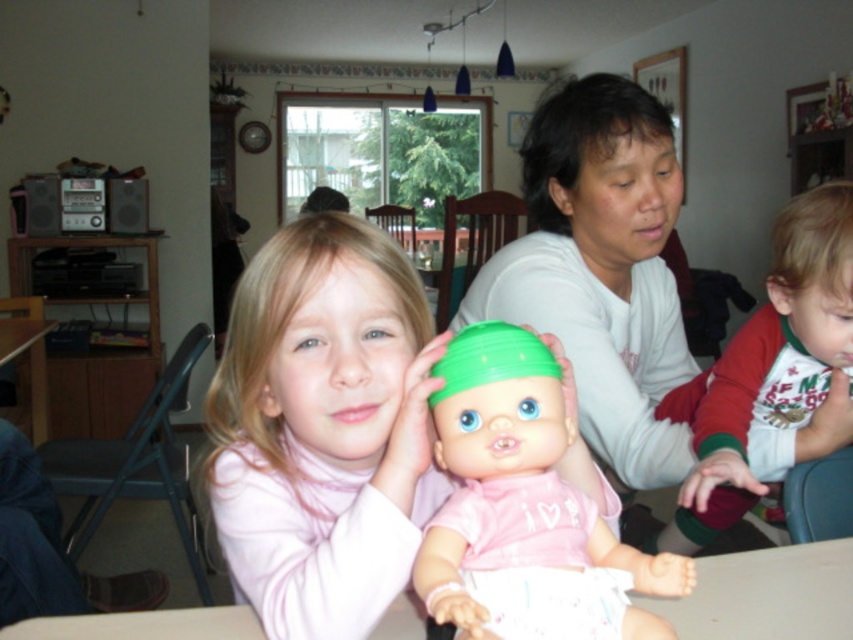
Question: Is green plastic doll at center wider than red fleece pajamas at lower right?

Choices:
 (A) no
 (B) yes

Answer: (A)

Question: Is green plastic doll at center above red fleece pajamas at lower right?

Choices:
 (A) yes
 (B) no

Answer: (A)

Question: Among these points, which one is nearest to the camera?

Choices:
 (A) (x=225, y=467)
 (B) (x=647, y=604)
 (C) (x=845, y=285)

Answer: (A)

Question: Among these objects, which one is farthest from the camera?

Choices:
 (A) red fleece pajamas at lower right
 (B) white plastic table at center

Answer: (B)

Question: Does pink matte doll at center have a larger size compared to white plastic table at center?

Choices:
 (A) no
 (B) yes

Answer: (B)

Question: Which object appears closest to the camera in this image?

Choices:
 (A) red fleece pajamas at lower right
 (B) pink matte doll at center
 (C) white matte doll at center
 (D) green plastic doll at center

Answer: (D)